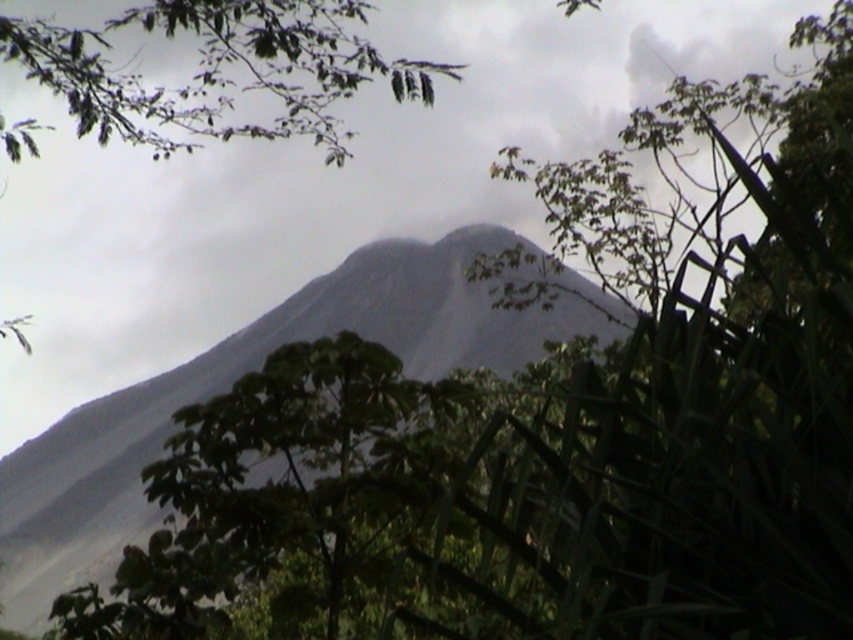
Is gray/rocky mountain at center below green leafy branch at upper left?

Yes, gray/rocky mountain at center is below green leafy branch at upper left.

Which is more to the right, gray/rocky mountain at center or green leafy branch at upper left?

gray/rocky mountain at center is more to the right.

Where is `gray/rocky mountain at center`? The height and width of the screenshot is (640, 853). gray/rocky mountain at center is located at coordinates (229, 387).